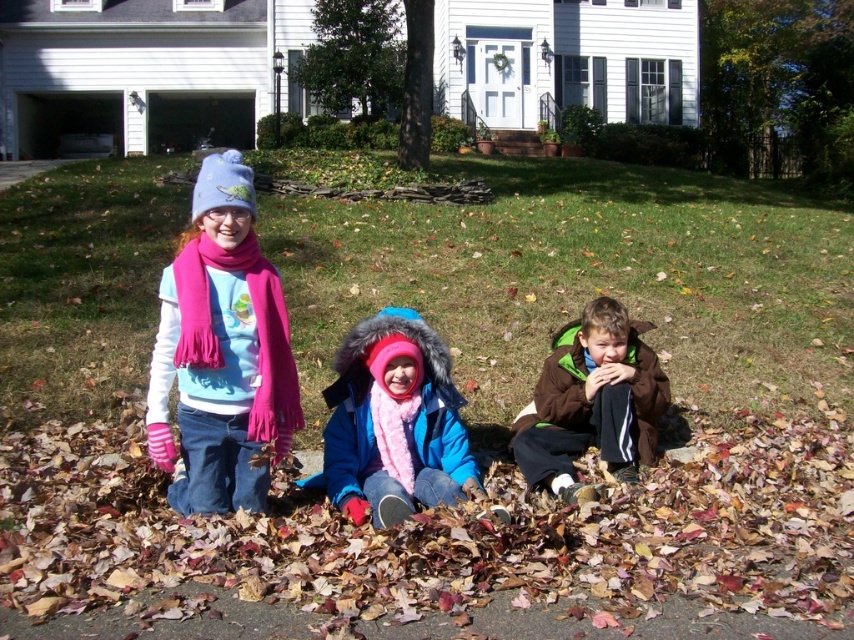
Based on the scene description, can you determine if the green grass at center is higher or lower than the blue fuzzy coat at center?

The green grass at center is above the blue fuzzy coat at center, so the grass is higher than the coat.

You are a parent trying to decide which coat to choose for your child based on their size. The blue fuzzy coat at center and the brown fleece jacket at lower right are both available. Which coat is narrower and thus more suitable for a smaller child?

The blue fuzzy coat at center is narrower than the brown fleece jacket at lower right, making it more suitable for a smaller child.